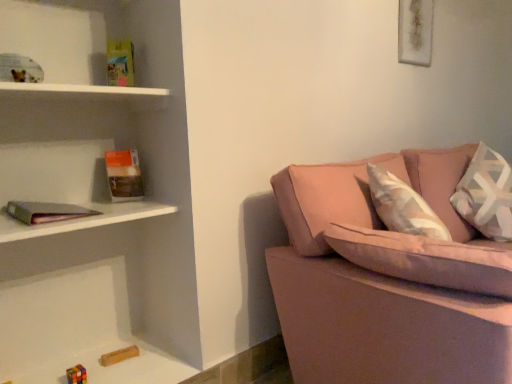
Question: Is hardcover book at left bigger than pink fabric couch at right?

Choices:
 (A) no
 (B) yes

Answer: (A)

Question: Can you confirm if hardcover book at left is taller than pink fabric couch at right?

Choices:
 (A) no
 (B) yes

Answer: (A)

Question: From the image's perspective, is hardcover book at left located beneath pink fabric couch at right?

Choices:
 (A) no
 (B) yes

Answer: (A)

Question: Considering the relative sizes of hardcover book at left and pink fabric couch at right in the image provided, is hardcover book at left thinner than pink fabric couch at right?

Choices:
 (A) no
 (B) yes

Answer: (B)

Question: Can you confirm if hardcover book at left is wider than pink fabric couch at right?

Choices:
 (A) no
 (B) yes

Answer: (A)

Question: Is hardcover book at left oriented towards pink fabric couch at right?

Choices:
 (A) no
 (B) yes

Answer: (A)

Question: Is white textured pillow at right taller than matte gray bookshelf at left?

Choices:
 (A) no
 (B) yes

Answer: (B)

Question: Is white textured pillow at right placed right next to matte gray bookshelf at left?

Choices:
 (A) no
 (B) yes

Answer: (A)

Question: From a real-world perspective, is white textured pillow at right under matte gray bookshelf at left?

Choices:
 (A) no
 (B) yes

Answer: (B)

Question: Considering the relative positions of white textured pillow at right and matte gray bookshelf at left in the image provided, is white textured pillow at right behind matte gray bookshelf at left?

Choices:
 (A) no
 (B) yes

Answer: (B)

Question: Does white textured pillow at right have a smaller size compared to matte gray bookshelf at left?

Choices:
 (A) no
 (B) yes

Answer: (A)

Question: Is white textured pillow at right closer to the viewer compared to matte gray bookshelf at left?

Choices:
 (A) no
 (B) yes

Answer: (A)

Question: Considering the relative sizes of hardcover book at left and white textured pillow at right in the image provided, is hardcover book at left wider than white textured pillow at right?

Choices:
 (A) yes
 (B) no

Answer: (B)